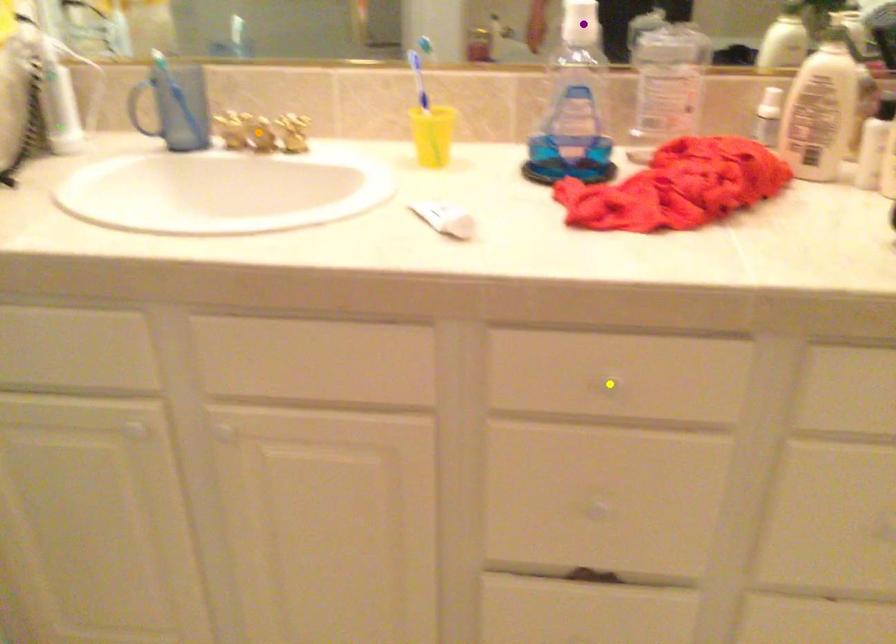
Order these from nearest to farthest:
purple point
yellow point
orange point

1. yellow point
2. orange point
3. purple point